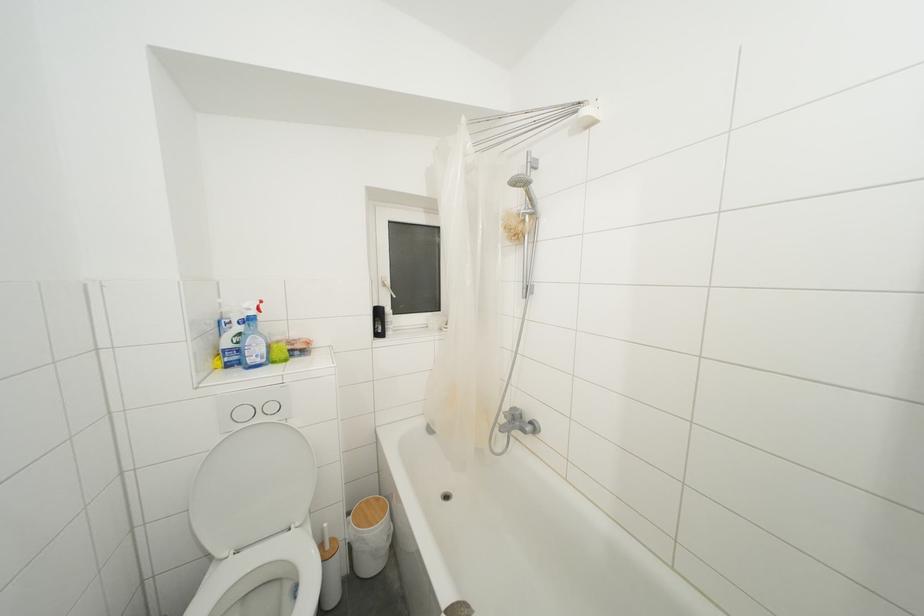
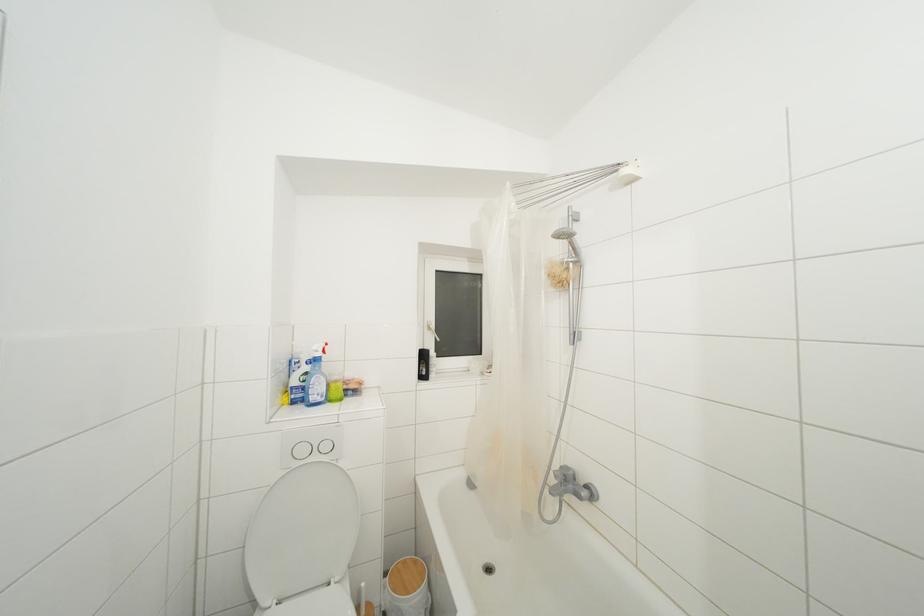
Locate, in the second image, the point that corresponds to point (388, 290) in the first image.

(433, 333)